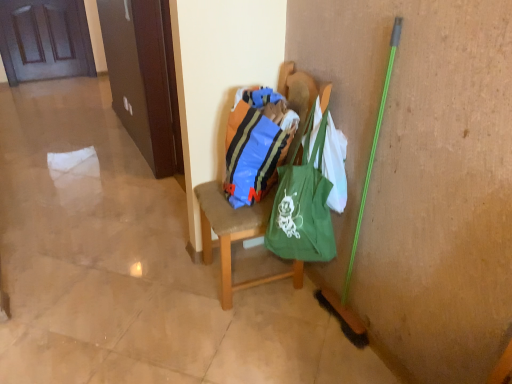
Locate an element on the screen. The height and width of the screenshot is (384, 512). green canvas tote at center is located at coordinates (303, 206).

Describe the element at coordinates (255, 145) in the screenshot. I see `blue striped fabric bag at center` at that location.

What is the approximate height of wooden chair at center?

wooden chair at center is 1.01 meters tall.

You are a GUI agent. You are given a task and a screenshot of the screen. Output one action in this format:
    pyautogui.click(x=<x>, y=<y>)
    Task: Click on the green canvas tote at center
    The height and width of the screenshot is (384, 512).
    Given the screenshot: What is the action you would take?
    pyautogui.click(x=303, y=206)

Which of these two, green canvas tote at center or blue striped fabric bag at center, is wider?

With larger width is green canvas tote at center.

Is blue striped fabric bag at center located within green canvas tote at center?

No.

Which object is positioned more to the left, green canvas tote at center or blue striped fabric bag at center?

Positioned to the left is blue striped fabric bag at center.

How different are the orientations of blue striped fabric bag at center and wooden door at upper left in degrees?

The angle between the facing direction of blue striped fabric bag at center and the facing direction of wooden door at upper left is 96.5 degrees.

Is blue striped fabric bag at center not inside wooden door at upper left?

Yes, blue striped fabric bag at center is not within wooden door at upper left.

From the picture: Would you consider blue striped fabric bag at center to be distant from wooden door at upper left?

Yes, blue striped fabric bag at center and wooden door at upper left are quite far apart.

Between point (293, 122) and point (82, 47), which one is positioned behind?

The point (82, 47) is behind.

Looking at this image, is blue striped fabric bag at center touching green canvas tote at center?

blue striped fabric bag at center and green canvas tote at center are clearly separated.

How different are the orientations of blue striped fabric bag at center and green canvas tote at center in degrees?

There is a 45.6-degree angle between the facing directions of blue striped fabric bag at center and green canvas tote at center.

Is blue striped fabric bag at center looking in the opposite direction of green canvas tote at center?

Absolutely, blue striped fabric bag at center is directed away from green canvas tote at center.

Which point is more forward, (270,173) or (307,258)?

Point (307,258)

From the image's perspective, relative to blue striped fabric bag at center, is wooden chair at center above or below?

From the image's perspective, wooden chair at center appears below blue striped fabric bag at center.

Is blue striped fabric bag at center inside wooden chair at center?

Yes, blue striped fabric bag at center is surrounded by wooden chair at center.

The width and height of the screenshot is (512, 384). What are the coordinates of `shopping bag located on the right of wooden chair at center` in the screenshot? It's located at (255, 145).

Is wooden chair at center oriented away from blue striped fabric bag at center?

Yes, wooden chair at center is facing away from blue striped fabric bag at center.

Is wooden chair at center to the left or to the right of green canvas tote at center in the image?

In the image, wooden chair at center appears on the left side of green canvas tote at center.

Locate an element on the screen. This screenshot has height=384, width=512. chair that appears on the left of green canvas tote at center is located at coordinates (236, 235).

Which is correct: wooden chair at center is inside green canvas tote at center, or outside of it?

wooden chair at center is spatially situated outside green canvas tote at center.

In the scene shown: From the image's perspective, which object appears higher, wooden chair at center or green canvas tote at center?

wooden chair at center, from the image's perspective.

Which object is closer to the camera taking this photo, green canvas tote at center or wooden door at upper left?

green canvas tote at center is closer to the camera.

Are green canvas tote at center and wooden door at upper left beside each other?

No, green canvas tote at center is not with wooden door at upper left.

Do you think green canvas tote at center is within wooden door at upper left, or outside of it?

green canvas tote at center exists outside the volume of wooden door at upper left.

Is wooden door at upper left to the left of blue striped fabric bag at center from the viewer's perspective?

Yes, wooden door at upper left is to the left of blue striped fabric bag at center.

Who is smaller, wooden door at upper left or blue striped fabric bag at center?

Smaller between the two is blue striped fabric bag at center.

From a real-world perspective, is wooden door at upper left on blue striped fabric bag at center?

No.

From the image's perspective, would you say wooden door at upper left is shown under blue striped fabric bag at center?

Incorrect, from the image's perspective, wooden door at upper left is higher than blue striped fabric bag at center.

Find the location of a particular element. The image size is (512, 384). shopping bag located behind the green canvas tote at center is located at coordinates (255, 145).

Where is `door on the left of blue striped fabric bag at center`? The image size is (512, 384). door on the left of blue striped fabric bag at center is located at coordinates (45, 40).

Based on their spatial positions, is wooden chair at center or wooden door at upper left closer to blue striped fabric bag at center?

The object closer to blue striped fabric bag at center is wooden chair at center.

Looking at the image, which one is located further to wooden chair at center, wooden door at upper left or blue striped fabric bag at center?

Based on the image, wooden door at upper left appears to be further to wooden chair at center.

Considering their positions, is blue striped fabric bag at center positioned further to wooden chair at center than wooden door at upper left?

The object further to wooden chair at center is wooden door at upper left.

From the image, which object appears to be farther from green canvas tote at center, wooden door at upper left or wooden chair at center?

wooden door at upper left is further to green canvas tote at center.

Consider the image. Which object lies further to the anchor point wooden chair at center, blue striped fabric bag at center or green canvas tote at center?

The object further to wooden chair at center is green canvas tote at center.

Considering their positions, is wooden chair at center positioned further to green canvas tote at center than wooden door at upper left?

Among the two, wooden door at upper left is located further to green canvas tote at center.

From the picture: From the image, which object appears to be nearer to blue striped fabric bag at center, green canvas tote at center or wooden chair at center?

wooden chair at center lies closer to blue striped fabric bag at center than the other object.

From the image, which object appears to be farther from wooden door at upper left, blue striped fabric bag at center or green canvas tote at center?

Among the two, green canvas tote at center is located further to wooden door at upper left.

You are a GUI agent. You are given a task and a screenshot of the screen. Output one action in this format:
    pyautogui.click(x=<x>, y=<y>)
    Task: Click on the shopping bag positioned between green canvas tote at center and wooden door at upper left from near to far
    Image resolution: width=512 pixels, height=384 pixels.
    Given the screenshot: What is the action you would take?
    pyautogui.click(x=255, y=145)

The height and width of the screenshot is (384, 512). I want to click on chair between green canvas tote at center and wooden door at upper left along the z-axis, so click(236, 235).

Image resolution: width=512 pixels, height=384 pixels. I want to click on shopping bag between wooden chair at center and green canvas tote at center in the horizontal direction, so click(255, 145).

Locate an element on the screen. Image resolution: width=512 pixels, height=384 pixels. shopping bag located between wooden chair at center and wooden door at upper left in the depth direction is located at coordinates (255, 145).